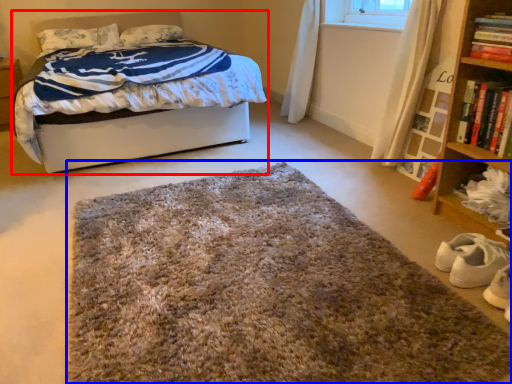
Question: Which object is closer to the camera taking this photo, bed (highlighted by a red box) or mat (highlighted by a blue box)?

Choices:
 (A) bed
 (B) mat

Answer: (B)